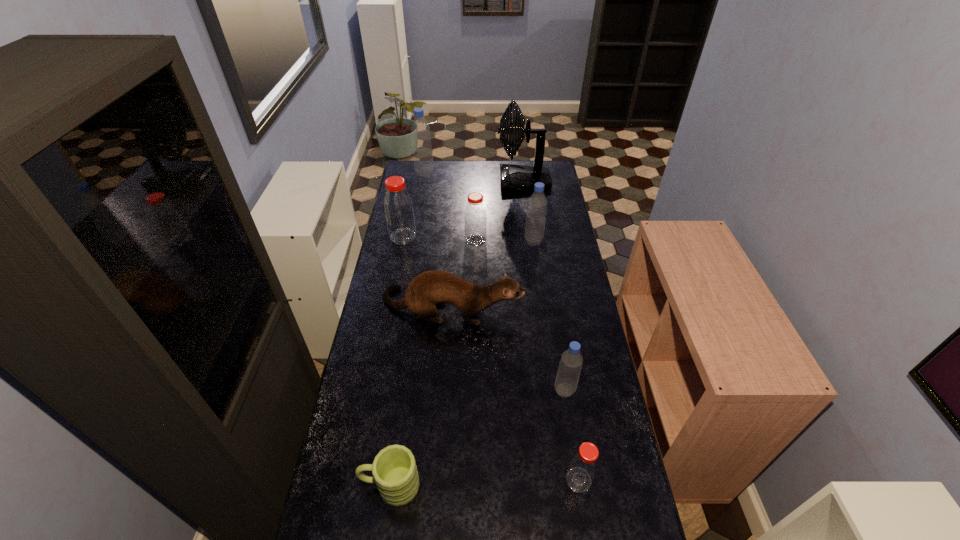
You are a GUI agent. You are given a task and a screenshot of the screen. Output one action in this format:
    pyautogui.click(x=<x>, y=<y>)
    Task: Click on the brown ferret
    The height and width of the screenshot is (540, 960).
    Given the screenshot: What is the action you would take?
    435,287

The image size is (960, 540). What are the coordinates of `the rightmost red bottle` in the screenshot? It's located at (583, 466).

Find the location of a particular element. the shortest bottle is located at coordinates (583, 466).

I want to click on the shortest object, so click(x=394, y=469).

Locate an element on the screen. The image size is (960, 540). green mug is located at coordinates (394, 469).

The image size is (960, 540). What are the coordinates of `vacant area located in front of the tallest object to blow air` in the screenshot? It's located at (452, 181).

I want to click on vacant area situated 0.240m in front of the tallest object to blow air, so click(452, 181).

Find the location of a particular element. free location located 0.350m in front of the tallest object to blow air is located at coordinates (431, 181).

You are a GUI agent. You are given a task and a screenshot of the screen. Output one action in this format:
    pyautogui.click(x=<x>, y=<y>)
    Task: Click on the vacant region located 0.120m on the right of the farthest blue bottle
    The height and width of the screenshot is (540, 960).
    Given the screenshot: What is the action you would take?
    pyautogui.click(x=456, y=173)

The image size is (960, 540). What are the coordinates of `free space located 0.260m on the front of the biggest red bottle` in the screenshot? It's located at (394, 286).